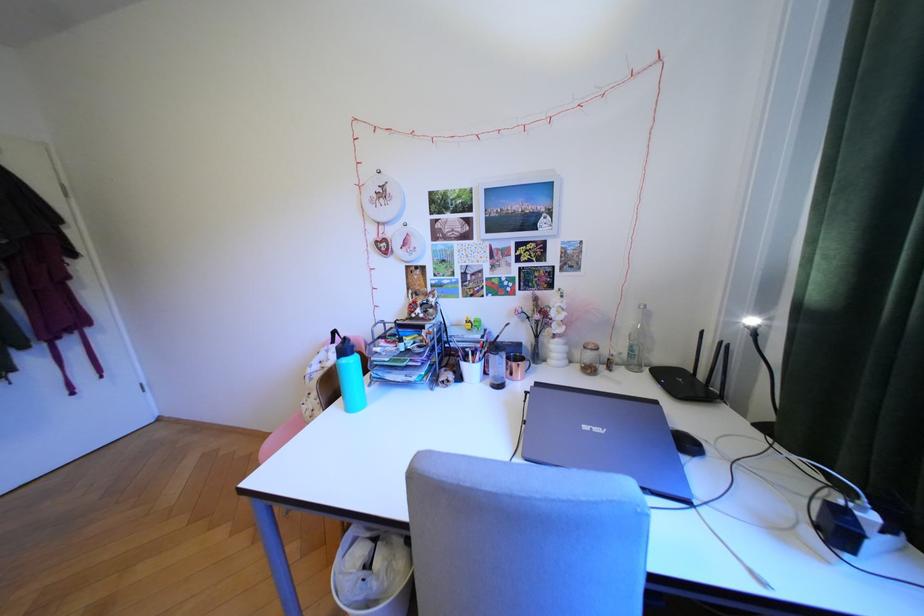
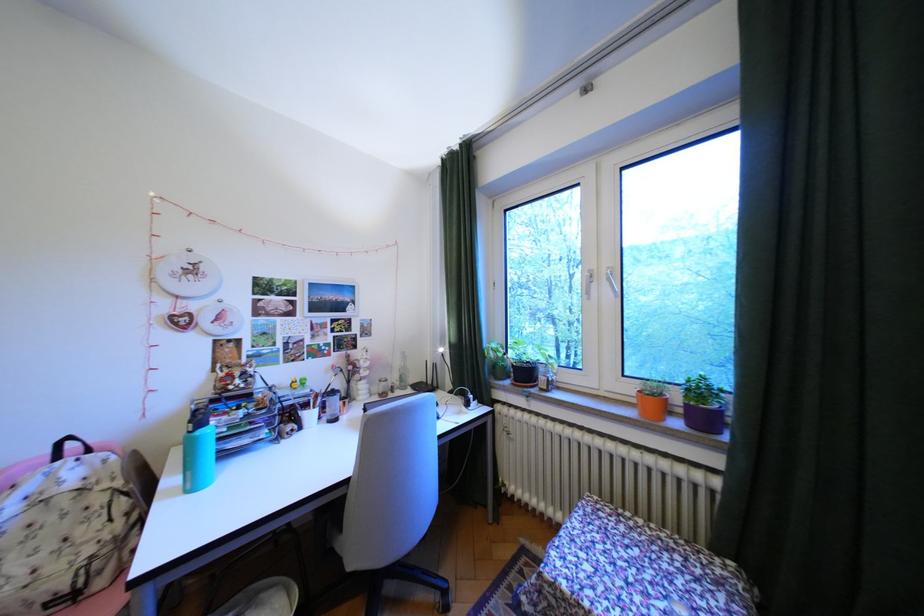
Find the pixel in the second image that matches point (356, 361) in the first image.

(212, 432)